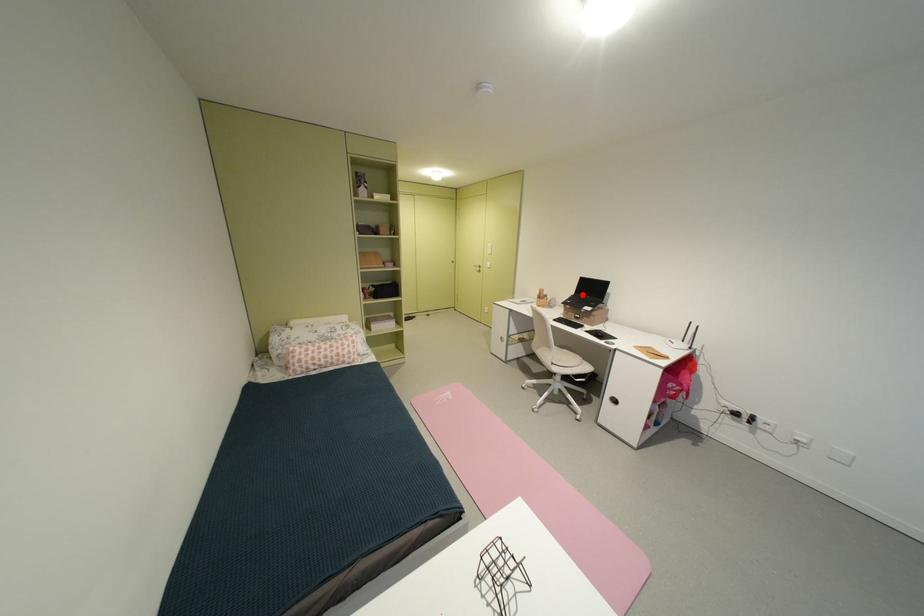
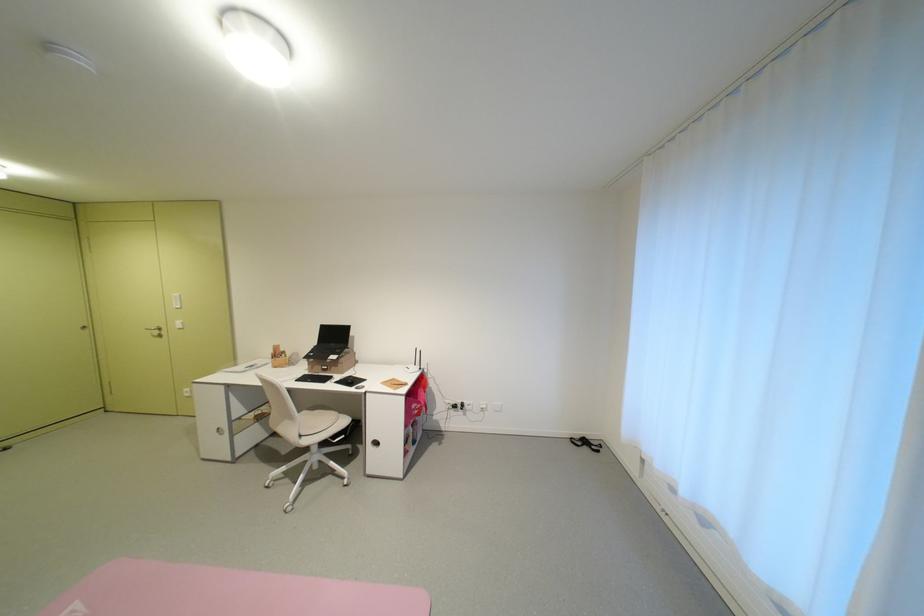
Find the pixel in the second image that matches the highlighted location in the first image.

(324, 345)